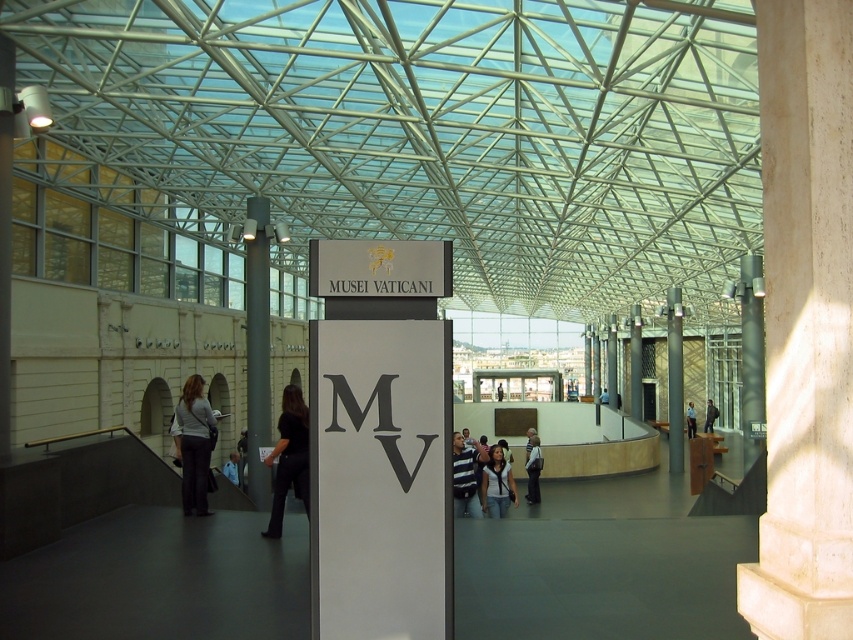
You are visiting the Vatican Museums and have a dark gray backpack at center and a dark gray jacket at right. Which item can you place on a narrow shelf that is only 30 cm wide?

The dark gray backpack at center can be placed on the narrow shelf since its width is less than 30 cm, while the dark gray jacket at right is wider and won

You are standing in the Vatican Museums and need to place your dark gray backpack at center and dark gray jacket at right into a storage locker. The locker is 10 feet wide. Can both items fit side by side in the locker?

The dark gray backpack at center is 71.57 feet from dark gray jacket at right, which means they are too far apart to fit into a 10 feet wide locker. Therefore, they cannot be placed side by side in the locker.

You are a tour guide in the Vatican Museums and need to lead a group from the satin silver column at left to the dark blue shirt at center. How far will you have to walk?

The satin silver column at left is 35.96 meters from the dark blue shirt at center, so you will have to walk 35.96 meters to reach the destination.